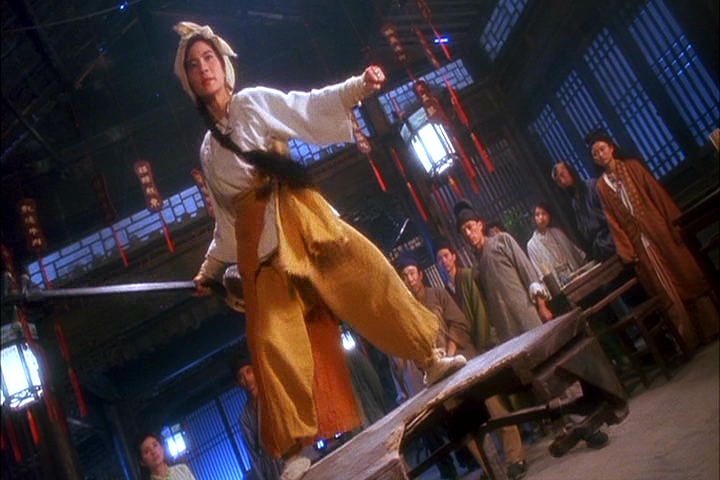
Identify the location of table. The height and width of the screenshot is (480, 720). (494, 357).